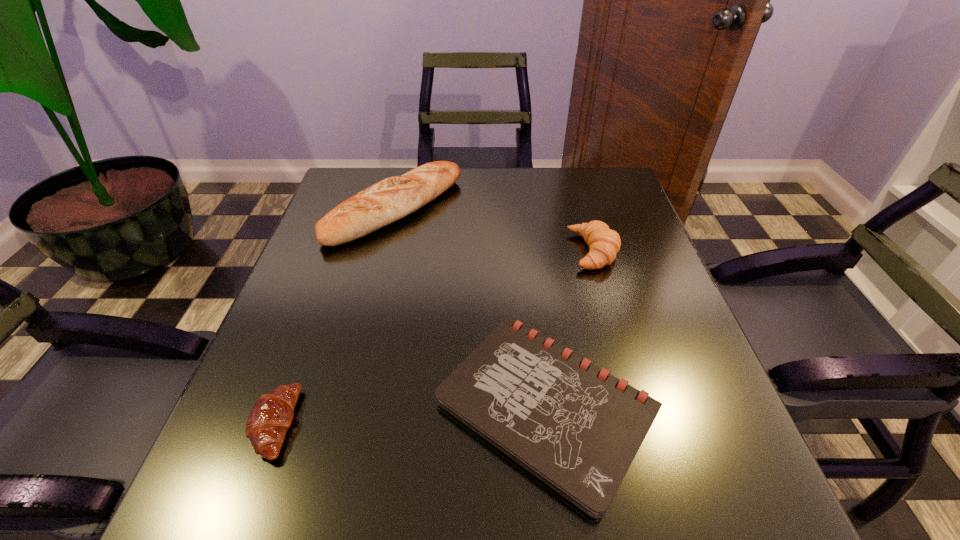
The image size is (960, 540). I want to click on object located in the far edge section of the desktop, so click(393, 198).

The width and height of the screenshot is (960, 540). What are the coordinates of `object that is at the near edge` in the screenshot? It's located at (577, 428).

I want to click on baguet present at the left edge, so click(x=393, y=198).

Where is `crescent roll situated at the left edge`? This screenshot has height=540, width=960. crescent roll situated at the left edge is located at coordinates [271, 416].

You are a GUI agent. You are given a task and a screenshot of the screen. Output one action in this format:
    pyautogui.click(x=<x>, y=<y>)
    Task: Click on the crescent roll positioned at the right edge
    This screenshot has width=960, height=540.
    Given the screenshot: What is the action you would take?
    pyautogui.click(x=604, y=243)

At what (x,y) coordinates should I click in order to perform the action: click on notebook that is positioned at the right edge. Please return your answer as a coordinate pair (x, y). The image size is (960, 540). Looking at the image, I should click on (577, 428).

Locate an element on the screen. The image size is (960, 540). object at the far left corner is located at coordinates (393, 198).

This screenshot has height=540, width=960. In order to click on object situated at the near right corner in this screenshot , I will do `click(577, 428)`.

In the image, there is a desktop. Where is `vacant space at the far edge`? vacant space at the far edge is located at coordinates click(525, 197).

You are a GUI agent. You are given a task and a screenshot of the screen. Output one action in this format:
    pyautogui.click(x=<x>, y=<y>)
    Task: Click on the free region at the near edge of the desktop
    
    Given the screenshot: What is the action you would take?
    pyautogui.click(x=363, y=474)